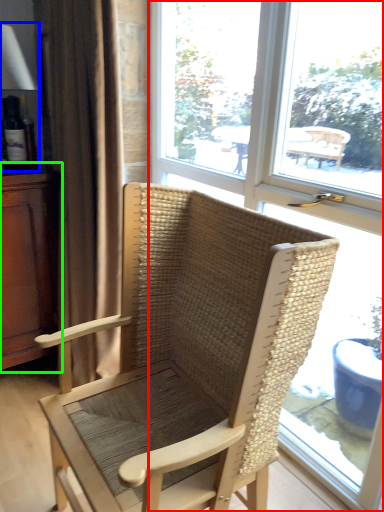
Question: Estimate the real-world distances between objects in this image. Which object is closer to window (highlighted by a red box), table lamp (highlighted by a blue box) or dresser (highlighted by a green box)?

Choices:
 (A) table lamp
 (B) dresser

Answer: (B)